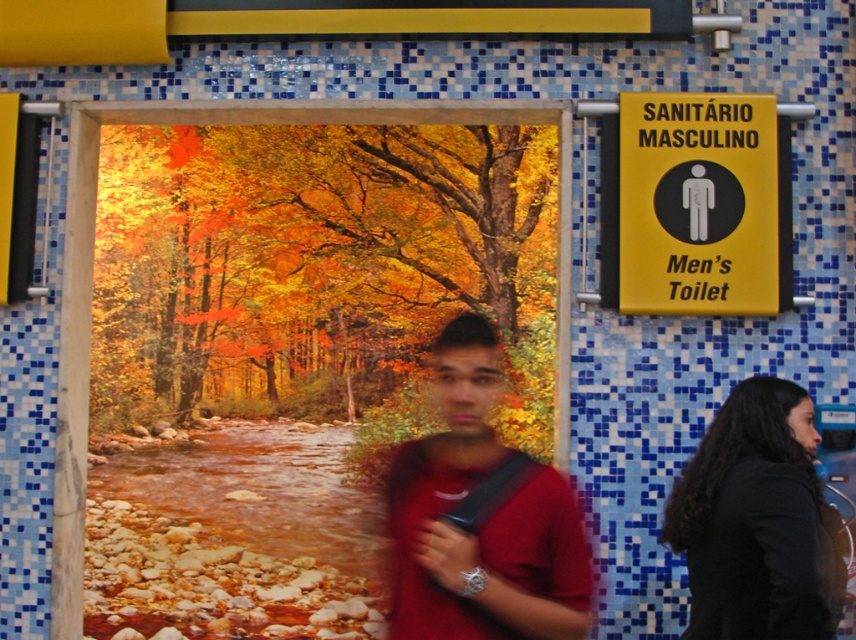
You are a tourist in a foreign country and see the scene described. You need to locate the restroom entrance. Which object would you look for first, the matte red shirt at center or the yellow paper sign at upper right, and why?

You should look for the yellow paper sign at upper right first because it is the indicator for the restroom entrance, while the matte red shirt at center might belong to a person who is not necessarily indicating the entrance.

You are standing in front of the restroom entrance and need to locate the yellow paper sign at upper right. Where should you look relative to the entrance?

The yellow paper sign at upper right is located at point [700,204], which is to the upper right side of the entrance.

You are standing in front of the restroom entrance and see a matte red shirt at center and a black fabric at right. Which object is nearer to you?

The matte red shirt at center is closer to the viewer than the black fabric at right.